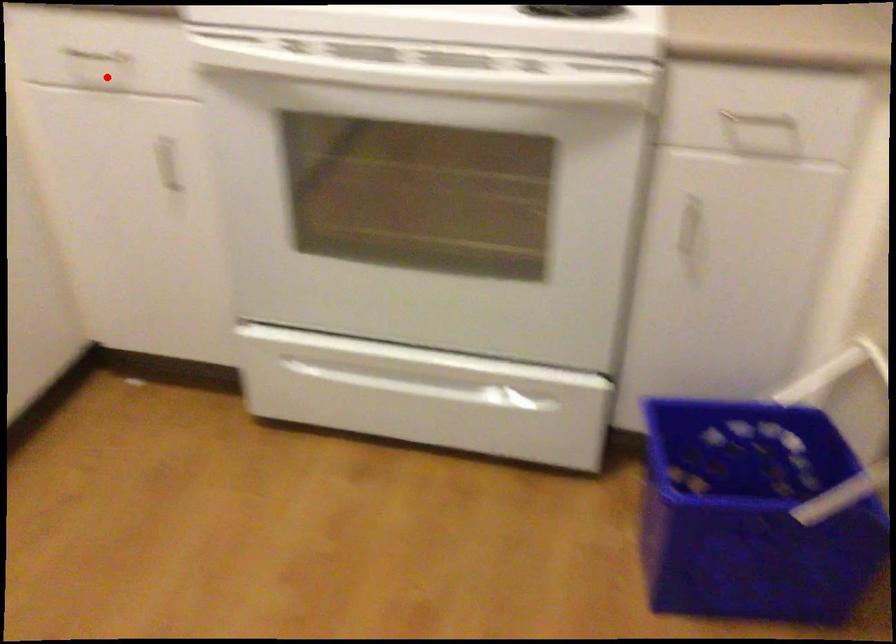
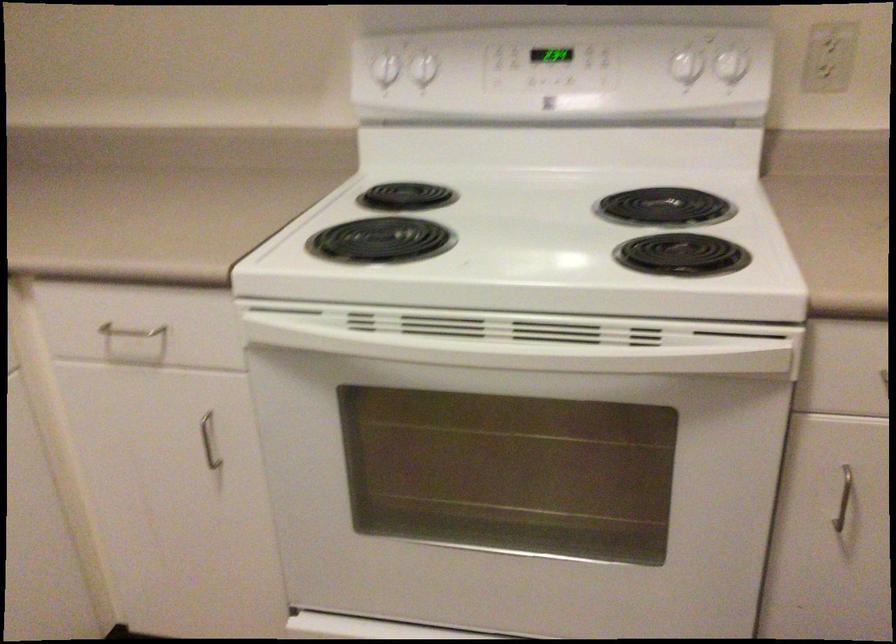
Question: I am providing you with two images of the same scene from different viewpoints. Given a red point in image1, look at the same physical point in image2. Is it:

Choices:
 (A) Closer to the viewpoint
 (B) Farther from the viewpoint

Answer: (A)